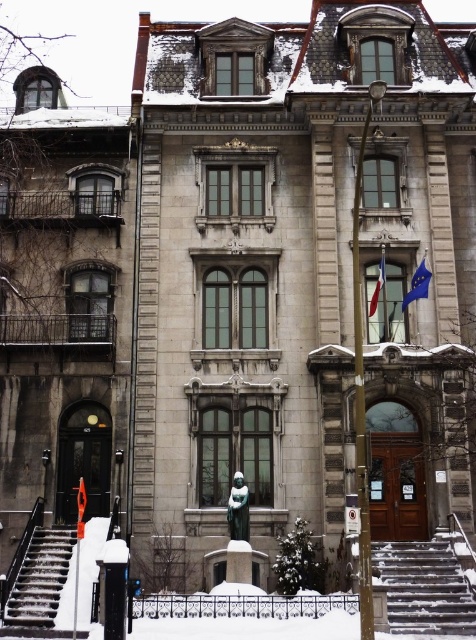
Question: Which is farther from the smooth concrete stairs at lower left?

Choices:
 (A) snow-covered stone stairs at lower right
 (B) blue fabric flag at upper right

Answer: (B)

Question: Which object is closer to the camera taking this photo?

Choices:
 (A) red fabric flag at center
 (B) smooth concrete stairs at lower left
 (C) blue fabric flag at upper right
 (D) snow-covered stone stairs at lower right

Answer: (D)

Question: Considering the relative positions of blue fabric flag at upper right and red fabric flag at center in the image provided, where is blue fabric flag at upper right located with respect to red fabric flag at center?

Choices:
 (A) right
 (B) left

Answer: (A)

Question: Is smooth concrete stairs at lower left below blue fabric flag at upper right?

Choices:
 (A) no
 (B) yes

Answer: (B)

Question: Does snow-covered stone stairs at lower right appear on the right side of smooth concrete stairs at lower left?

Choices:
 (A) no
 (B) yes

Answer: (B)

Question: Which point is closer to the camera taking this photo?

Choices:
 (A) (45, 538)
 (B) (379, 284)
 (C) (425, 296)
 (D) (474, 593)

Answer: (D)